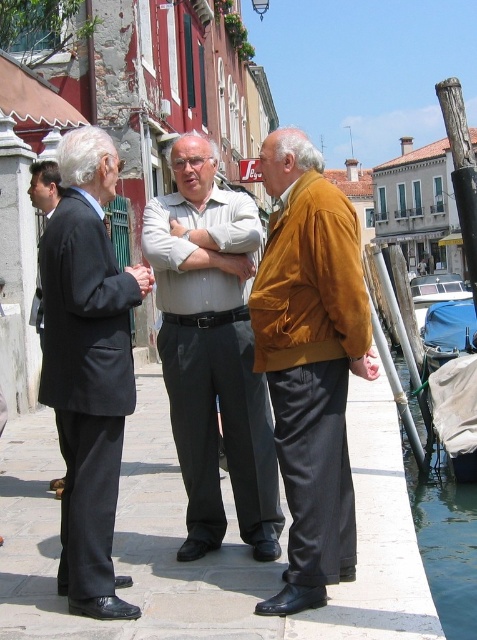
You are a photographer planning to take a picture of the canal scene. You want to ensure both the matte black suit at left and the clear blue water at lower right are in focus. Given their size difference, which object should you focus on to maximize the depth of field?

The matte black suit at left is smaller in size compared to the clear blue water at lower right. To maximize depth of field, focus on the matte black suit at left since smaller objects can be in focus more easily when positioned closer to the camera.

You are a tailor who needs to determine which clothing item requires more fabric to alter. Looking at the matte orange jacket at center and the light gray cotton shirt at center, which one would need more fabric for adjustments?

The matte orange jacket at center requires more fabric for alterations since it is larger than the light gray cotton shirt at center.

You are a tour guide leading a group along the canal and want to ensure everyone can hear you. You notice the light gray cotton shirt at center and the black suit coat at left. How far apart are these two individuals?

The light gray cotton shirt at center and the black suit coat at left are 13.26 feet apart from each other.